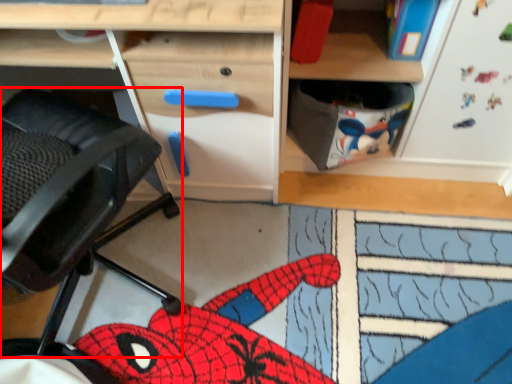
Question: Considering the relative positions of swivel chair (annotated by the red box) and desk in the image provided, where is swivel chair (annotated by the red box) located with respect to the staircase?

Choices:
 (A) right
 (B) left

Answer: (B)